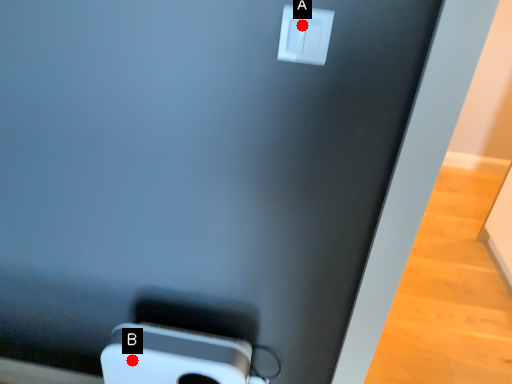
Question: Two points are circled on the image, labeled by A and B beside each circle. Which point is farther from the camera taking this photo?

Choices:
 (A) A is further
 (B) B is further

Answer: (B)